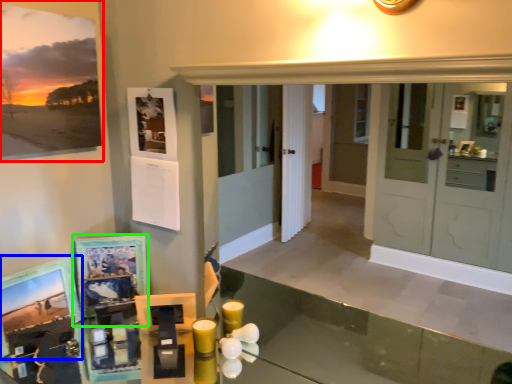
Question: Based on their relative distances, which object is farther from picture frame (highlighted by a red box)? Choose from picture frame (highlighted by a blue box) and picture frame (highlighted by a green box).

Choices:
 (A) picture frame
 (B) picture frame

Answer: (A)